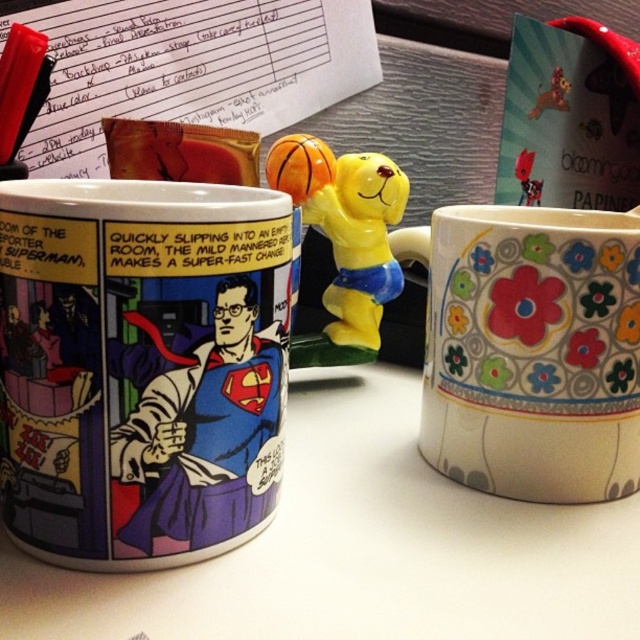
Question: Does yellow matte basketball player at center have a greater width compared to black plastic pen at upper left?

Choices:
 (A) no
 (B) yes

Answer: (B)

Question: Which object is positioned farthest from the black plastic pen at upper left?

Choices:
 (A) comic book print mug at center
 (B) floral ceramic mug at right

Answer: (B)

Question: Is comic book print mug at center positioned in front of black plastic pen at upper left?

Choices:
 (A) no
 (B) yes

Answer: (B)

Question: Which of these objects is positioned closest to the superman comic at center?

Choices:
 (A) yellow matte basketball player at center
 (B) floral ceramic mug at right
 (C) comic book print mug at center

Answer: (C)

Question: Is superman comic at center bigger than yellow matte basketball player at center?

Choices:
 (A) yes
 (B) no

Answer: (B)

Question: Which object appears farthest from the camera in this image?

Choices:
 (A) superman comic at center
 (B) black plastic pen at upper left
 (C) yellow matte basketball player at center

Answer: (C)